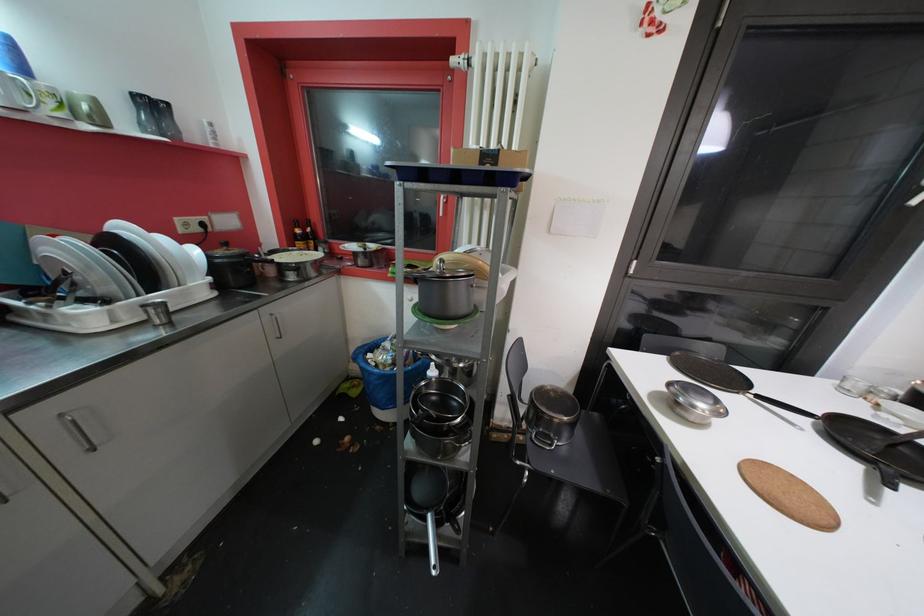
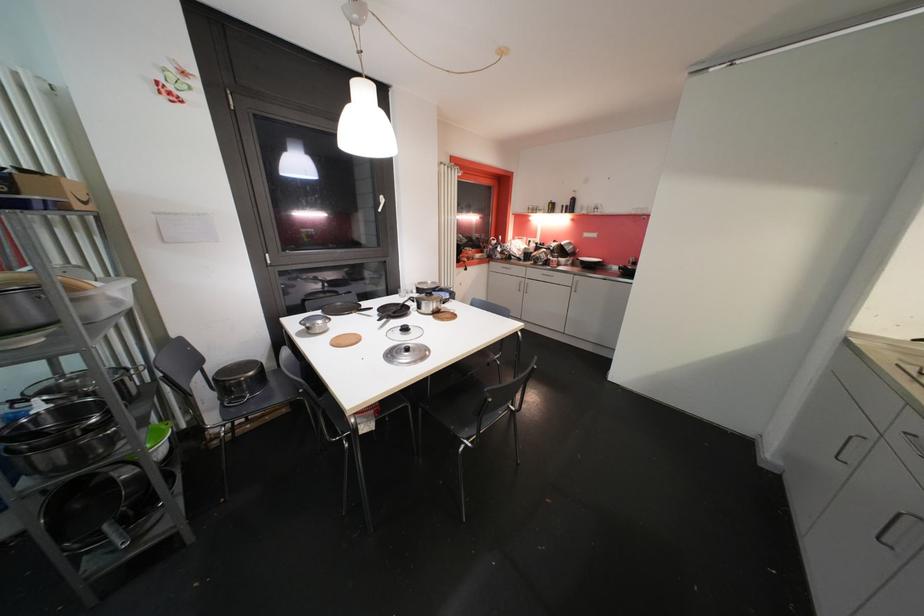
Question: The camera is either moving clockwise (left) or counter-clockwise (right) around the object. The first image is from the beginning of the video and the second image is from the end. Is the camera moving left or right when shooting the video?

Choices:
 (A) Left
 (B) Right

Answer: (A)